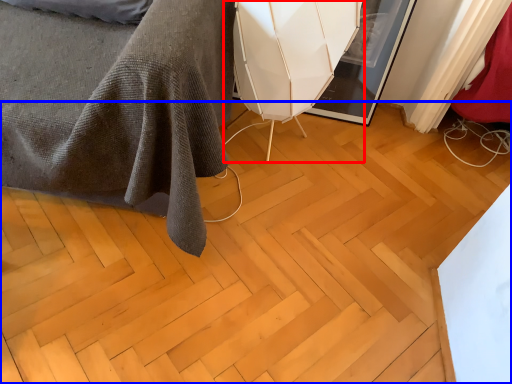
Question: Among these objects, which one is nearest to the camera, swivel chair (highlighted by a red box) or plywood (highlighted by a blue box)?

Choices:
 (A) swivel chair
 (B) plywood

Answer: (B)